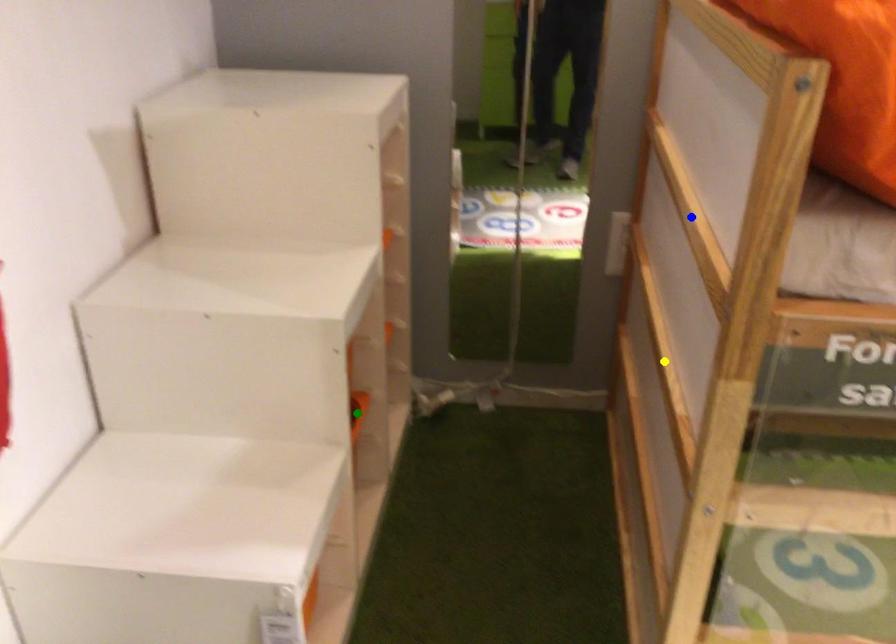
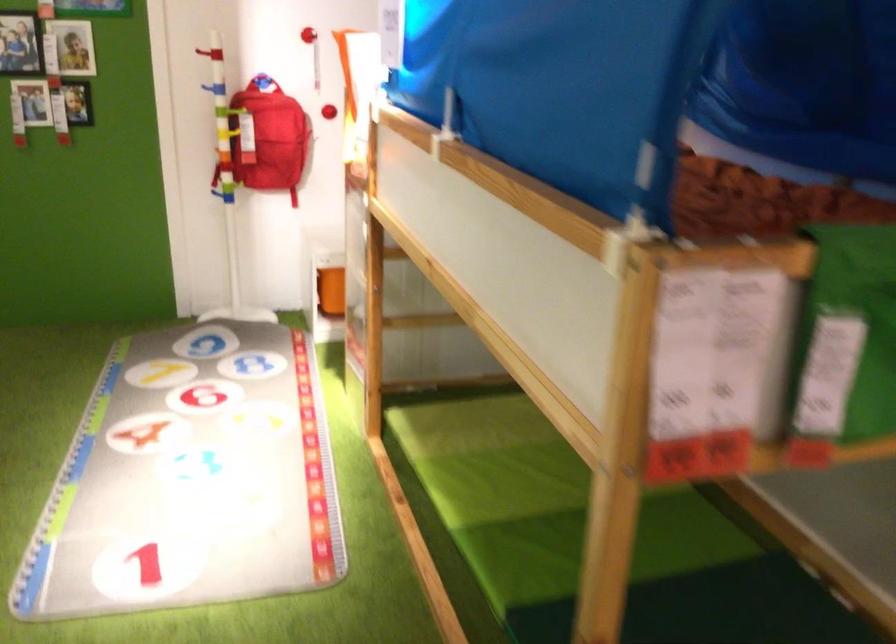
I am providing you with two images of the same scene from different viewpoints. Three points are marked in image1. Which point corresponds to a part or object that is occluded in image2?In image1, three points are marked. Which of them correspond to a part or object that is occluded in image2?Among the three points shown in image1, which one corresponds to a part or object that is no longer visible due to occlusion in image2?

yellow point, blue point, green point cannot be seen in image2.